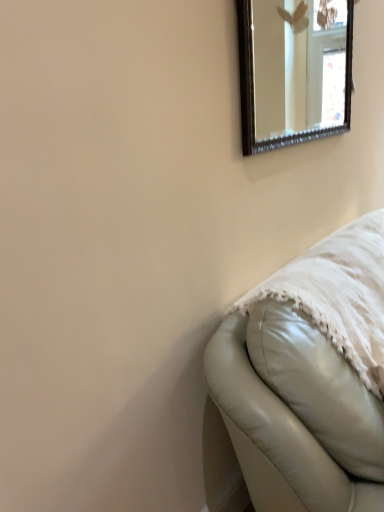
Question: Can we say leather couch at lower right lies outside black-framed mirror at upper right?

Choices:
 (A) yes
 (B) no

Answer: (A)

Question: Does leather couch at lower right come in front of black-framed mirror at upper right?

Choices:
 (A) no
 (B) yes

Answer: (B)

Question: From a real-world perspective, is leather couch at lower right located higher than black-framed mirror at upper right?

Choices:
 (A) yes
 (B) no

Answer: (B)

Question: Does leather couch at lower right have a lesser width compared to black-framed mirror at upper right?

Choices:
 (A) yes
 (B) no

Answer: (B)

Question: Does leather couch at lower right appear on the right side of black-framed mirror at upper right?

Choices:
 (A) no
 (B) yes

Answer: (B)

Question: Is leather couch at lower right facing away from black-framed mirror at upper right?

Choices:
 (A) yes
 (B) no

Answer: (B)

Question: Is black-framed mirror at upper right looking in the opposite direction of leather couch at lower right?

Choices:
 (A) no
 (B) yes

Answer: (A)

Question: Is black-framed mirror at upper right outside leather couch at lower right?

Choices:
 (A) yes
 (B) no

Answer: (A)

Question: From the image's perspective, is black-framed mirror at upper right under leather couch at lower right?

Choices:
 (A) no
 (B) yes

Answer: (A)

Question: Is black-framed mirror at upper right further to camera compared to leather couch at lower right?

Choices:
 (A) yes
 (B) no

Answer: (A)

Question: Does black-framed mirror at upper right have a greater width compared to leather couch at lower right?

Choices:
 (A) no
 (B) yes

Answer: (A)

Question: Is black-framed mirror at upper right at the right side of leather couch at lower right?

Choices:
 (A) yes
 (B) no

Answer: (B)

Question: Which is correct: leather couch at lower right is inside black-framed mirror at upper right, or outside of it?

Choices:
 (A) outside
 (B) inside

Answer: (A)